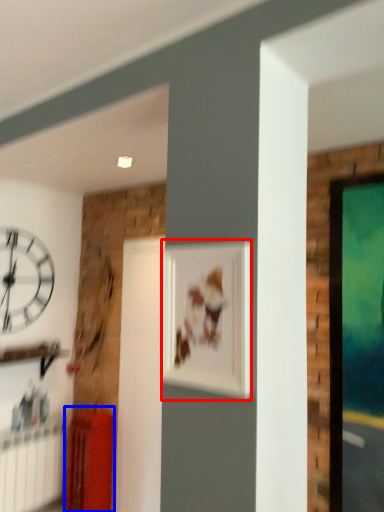
Question: Which object appears farthest to the camera in this image, picture frame (highlighted by a red box) or furniture (highlighted by a blue box)?

Choices:
 (A) picture frame
 (B) furniture

Answer: (B)